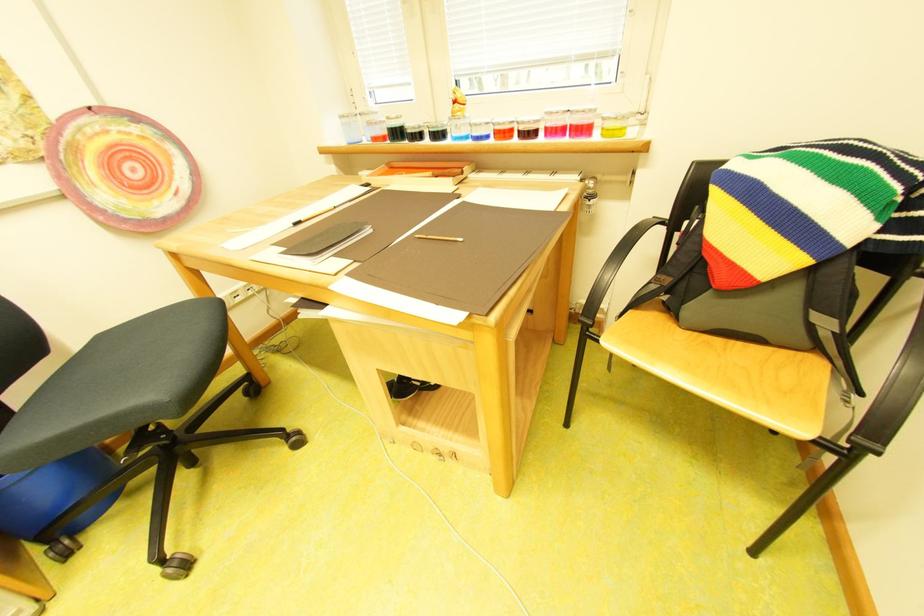
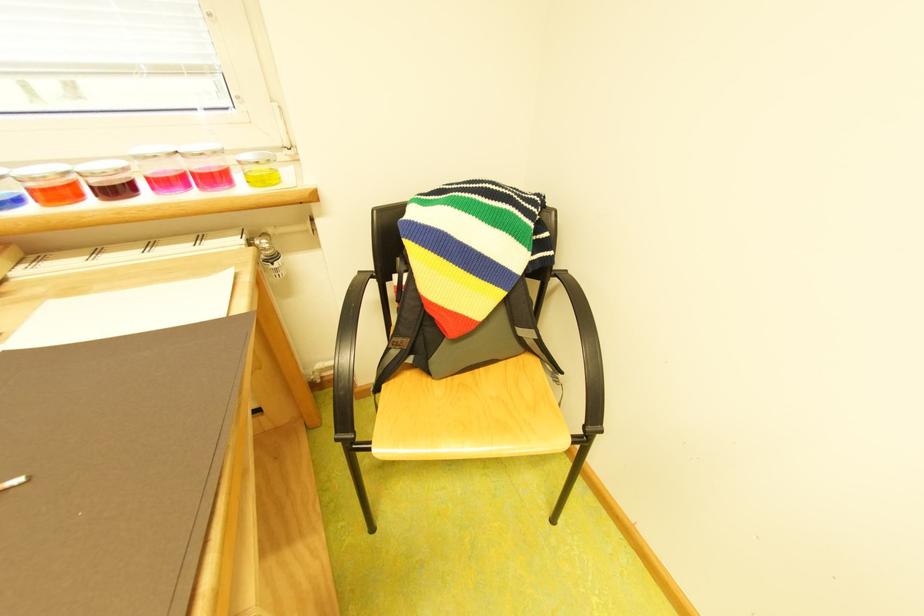
The point at (609, 132) is marked in the first image. Where is the corresponding point in the second image?

(250, 179)